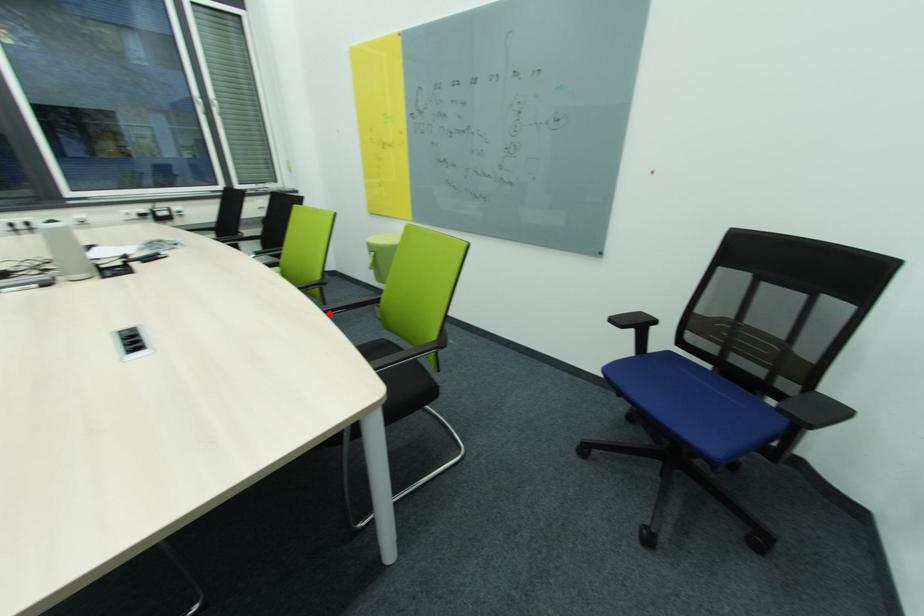
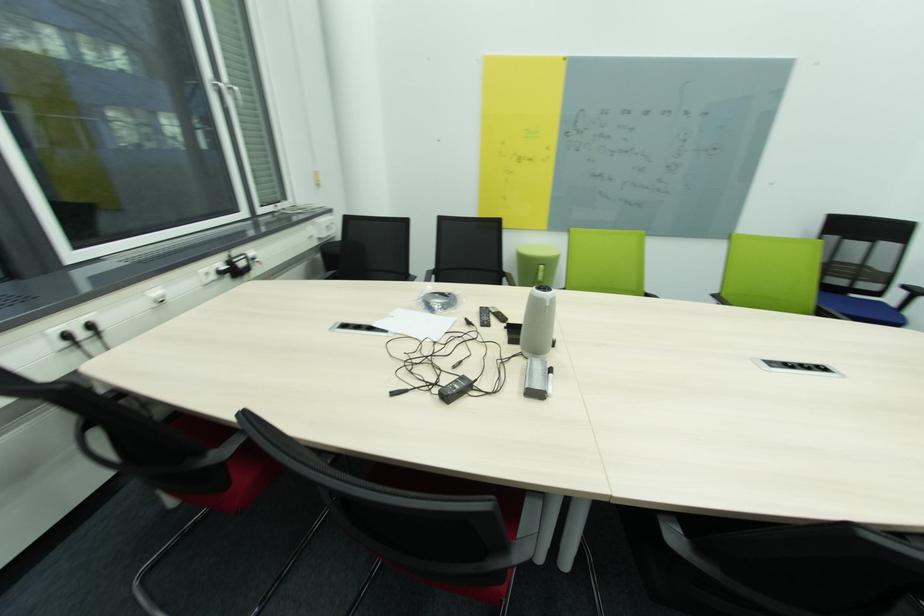
Question: I am providing you with two images of the same scene from different viewpoints. A red point is marked on the first image. At the location where the point appears in image 1, is it still visible in image 2?

Choices:
 (A) Yes
 (B) No

Answer: (B)